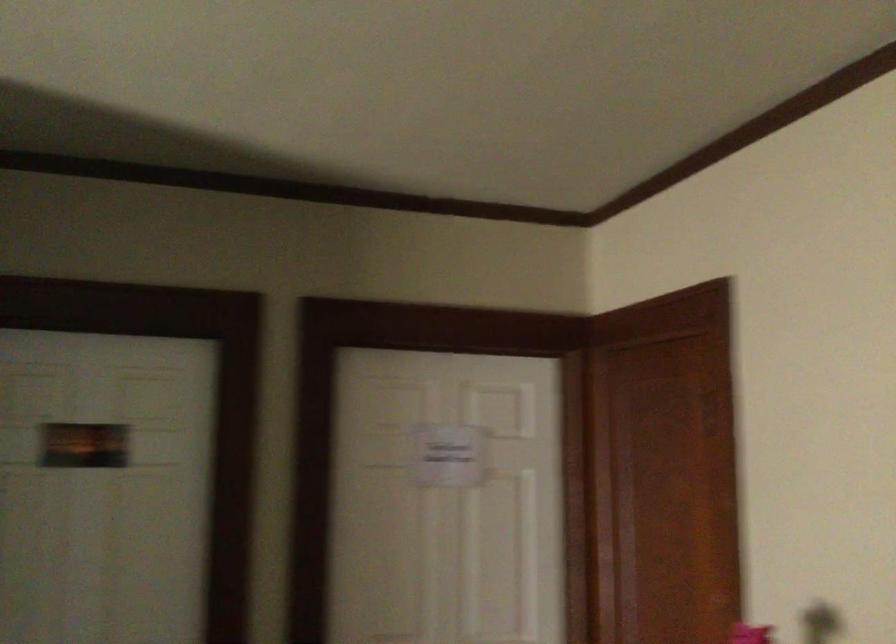
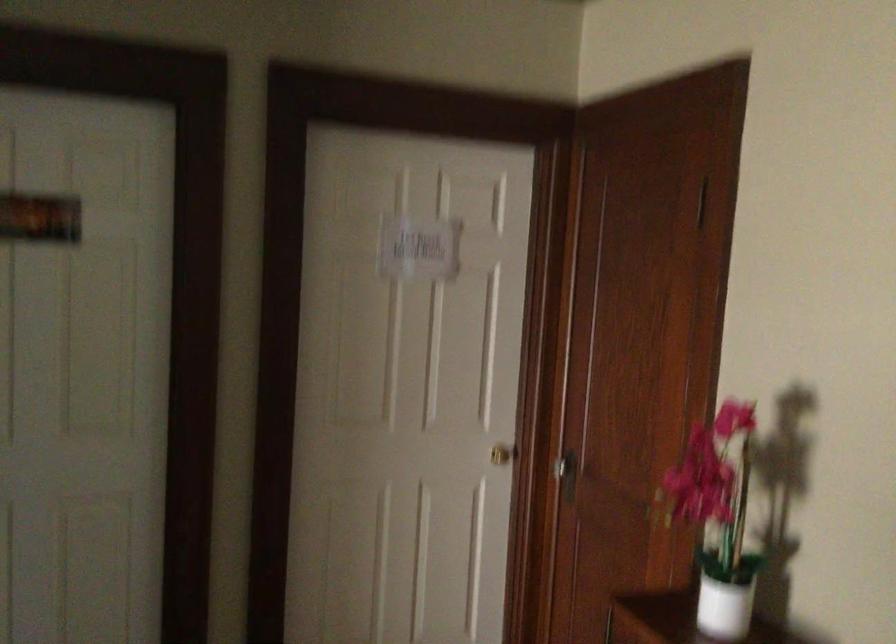
In a continuous first-person perspective shot, in which direction is the camera moving?

The cameraman walked toward left, forward.